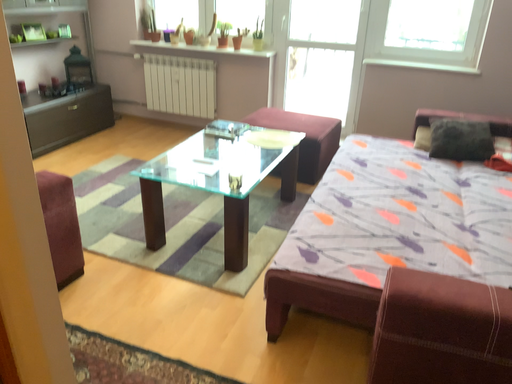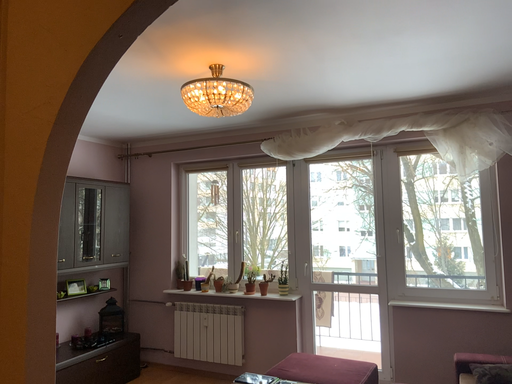
Question: How did the camera likely rotate when shooting the video?

Choices:
 (A) rotated upward
 (B) rotated downward

Answer: (A)